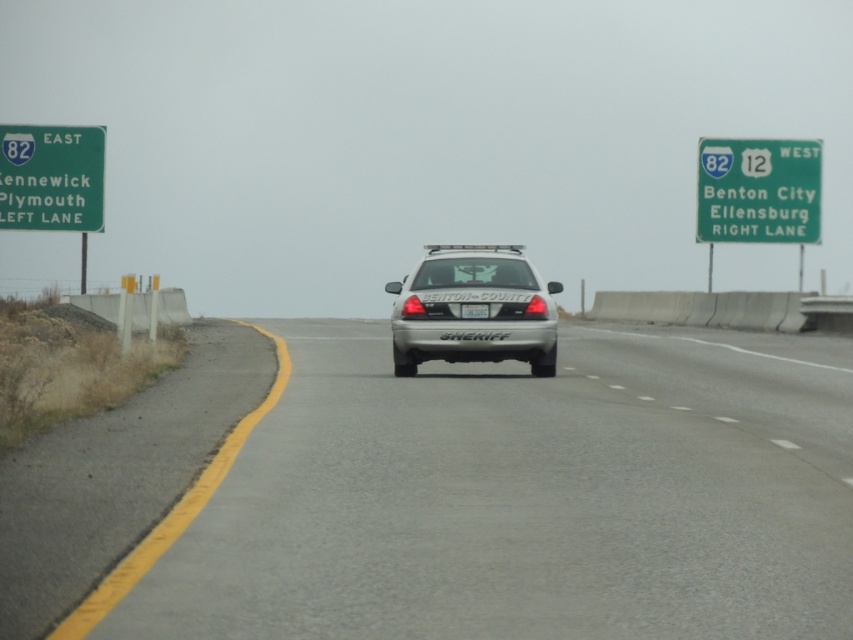
Based on the photo, you are a driver approaching the highway and see the green plastic sign at left and the white plastic license plate at center. Which object is taller?

The green plastic sign at left is taller than the white plastic license plate at center.

You are a driver approaching the highway and see the gray asphalt road at center and the green sign at right. Which object is located above the other?

The green sign at right is above the gray asphalt road at center because the gray asphalt road at center is positioned under green sign at right.

From the picture: You are a driver approaching the highway and need to determine which point is closer to you. The points are located at coordinates point (x=79, y=148) and point (x=486, y=314). Which point is closer to your current position?

Point (x=79, y=148) is closer to your current position because it is further to the viewer than point (x=486, y=314).